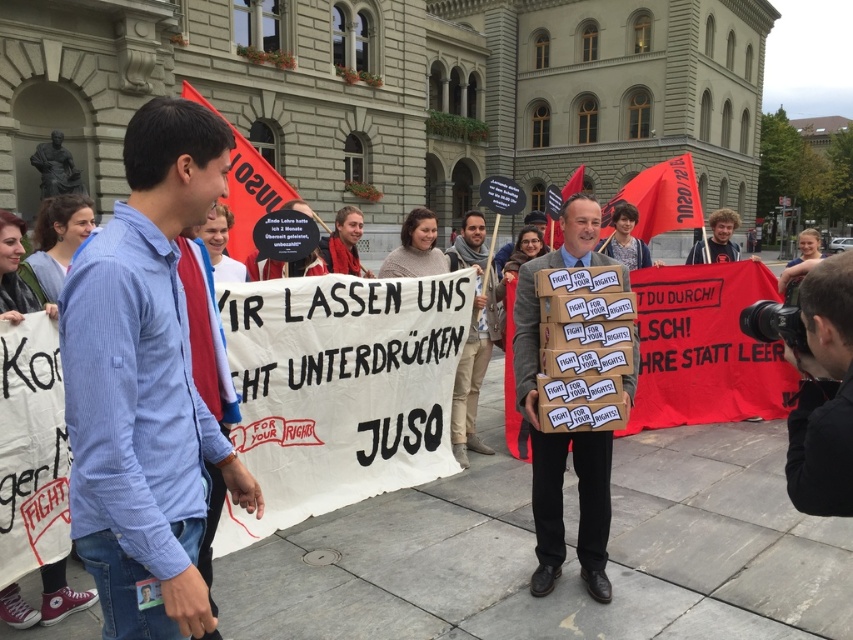
You are a photographer trying to capture a photo of the protest. You notice the matte black camera at right and the brown leather jacket at center. Which object is positioned lower in the frame?

The matte black camera at right is below the brown leather jacket at center, so it is positioned lower in the frame.

You are a photographer trying to capture the protest scene. You have a matte black camera at right and a red fabric flag at upper left in your viewfinder. Which object will appear smaller in your photo?

The matte black camera at right has a lesser width compared to the red fabric flag at upper left, so it will appear smaller in the photo.